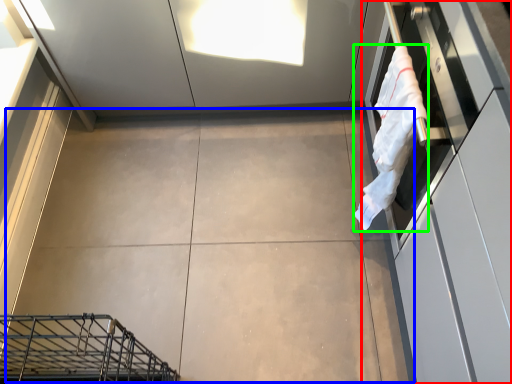
Question: Which is farther away from cabinetry (highlighted by a red box)? concrete (highlighted by a blue box) or laundry (highlighted by a green box)?

Choices:
 (A) concrete
 (B) laundry

Answer: (A)